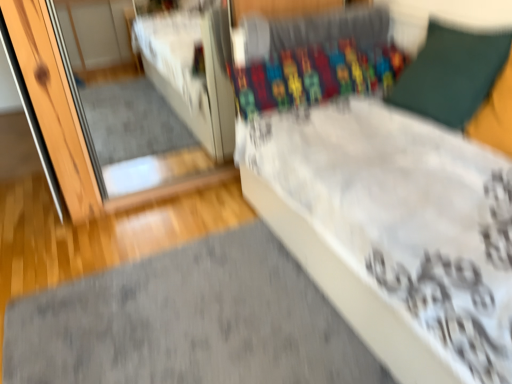
Describe the element at coordinates (137, 147) in the screenshot. The image size is (512, 384). I see `white glossy mirror at upper left` at that location.

The image size is (512, 384). Describe the element at coordinates (188, 322) in the screenshot. I see `gray soft mat at lower left` at that location.

Find the location of a particular element. The height and width of the screenshot is (384, 512). green fabric pillow at upper right is located at coordinates (451, 74).

Can you confirm if green fabric pillow at upper right is positioned to the left of gray soft mat at lower left?

No.

How distant is green fabric pillow at upper right from gray soft mat at lower left?

3.61 feet.

From the picture: Can you confirm if green fabric pillow at upper right is shorter than gray soft mat at lower left?

Incorrect, the height of green fabric pillow at upper right does not fall short of that of gray soft mat at lower left.

Would you say white glossy mirror at upper left contains green fabric pillow at upper right?

No, green fabric pillow at upper right is not a part of white glossy mirror at upper left.

Which object is more forward, white glossy mirror at upper left or green fabric pillow at upper right?

Positioned in front is green fabric pillow at upper right.

Is white glossy mirror at upper left facing away from green fabric pillow at upper right?

white glossy mirror at upper left does not have its back to green fabric pillow at upper right.

From a real-world perspective, who is located higher, green fabric pillow at upper right or white glossy mirror at upper left?

Result: In real-world perspective, green fabric pillow at upper right is above.

Would you say green fabric pillow at upper right contains white glossy mirror at upper left?

That's incorrect, white glossy mirror at upper left is not inside green fabric pillow at upper right.

How far apart are green fabric pillow at upper right and white glossy mirror at upper left?

green fabric pillow at upper right is 1.43 meters away from white glossy mirror at upper left.

Locate an element on the screen. Image resolution: width=512 pixels, height=384 pixels. mirror behind the green fabric pillow at upper right is located at coordinates (137, 147).

Is gray soft mat at lower left in contact with white glossy mirror at upper left?

gray soft mat at lower left is not next to white glossy mirror at upper left, and they're not touching.

Locate an element on the screen. mirror above the gray soft mat at lower left (from a real-world perspective) is located at coordinates (137, 147).

Is white glossy mirror at upper left completely or partially inside gray soft mat at lower left?

No, white glossy mirror at upper left is not surrounded by gray soft mat at lower left.

From the image's perspective, is gray soft mat at lower left on top of white glossy mirror at upper left?

No, from the image's perspective, gray soft mat at lower left is not on top of white glossy mirror at upper left.

From a real-world perspective, does white glossy mirror at upper left stand above gray soft mat at lower left?

Yes, from a real-world perspective, white glossy mirror at upper left is above gray soft mat at lower left.

In the scene shown: Do you think white glossy mirror at upper left is within gray soft mat at lower left, or outside of it?

white glossy mirror at upper left is spatially situated outside gray soft mat at lower left.

Is white glossy mirror at upper left looking in the opposite direction of gray soft mat at lower left?

Yes, white glossy mirror at upper left is positioned with its back facing gray soft mat at lower left.

From the image's perspective, is gray soft mat at lower left below green fabric pillow at upper right?

Yes.

From a real-world perspective, is gray soft mat at lower left located higher than green fabric pillow at upper right?

No, from a real-world perspective, gray soft mat at lower left is not over green fabric pillow at upper right

Which object is closer to the camera, gray soft mat at lower left or green fabric pillow at upper right?

gray soft mat at lower left is closer to the camera.

How many degrees apart are the facing directions of gray soft mat at lower left and green fabric pillow at upper right?

They differ by 11.4 degrees in their facing directions.

Where is `doormat that is on the left side of green fabric pillow at upper right`? The image size is (512, 384). doormat that is on the left side of green fabric pillow at upper right is located at coordinates (x=188, y=322).

Locate an element on the screen. The height and width of the screenshot is (384, 512). mirror behind the green fabric pillow at upper right is located at coordinates (137, 147).

Estimate the real-world distances between objects in this image. Which object is closer to white glossy mirror at upper left, green fabric pillow at upper right or gray soft mat at lower left?

gray soft mat at lower left lies closer to white glossy mirror at upper left than the other object.

Looking at the image, which one is located further to green fabric pillow at upper right, white glossy mirror at upper left or gray soft mat at lower left?

Based on the image, white glossy mirror at upper left appears to be further to green fabric pillow at upper right.

When comparing their distances from gray soft mat at lower left, does white glossy mirror at upper left or green fabric pillow at upper right seem closer?

green fabric pillow at upper right lies closer to gray soft mat at lower left than the other object.

Estimate the real-world distances between objects in this image. Which object is closer to white glossy mirror at upper left, gray soft mat at lower left or green fabric pillow at upper right?

gray soft mat at lower left is closer to white glossy mirror at upper left.

Estimate the real-world distances between objects in this image. Which object is further from gray soft mat at lower left, green fabric pillow at upper right or white glossy mirror at upper left?

white glossy mirror at upper left.

Looking at the image, which one is located closer to green fabric pillow at upper right, gray soft mat at lower left or white glossy mirror at upper left?

gray soft mat at lower left is closer to green fabric pillow at upper right.

Where is `doormat between white glossy mirror at upper left and green fabric pillow at upper right from left to right`? This screenshot has width=512, height=384. doormat between white glossy mirror at upper left and green fabric pillow at upper right from left to right is located at coordinates (188, 322).